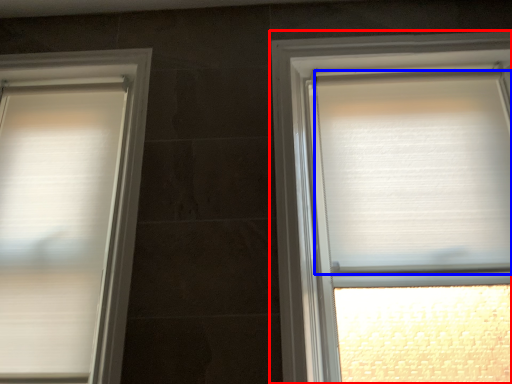
Question: Among these objects, which one is farthest to the camera, window (highlighted by a red box) or blind (highlighted by a blue box)?

Choices:
 (A) window
 (B) blind

Answer: (B)